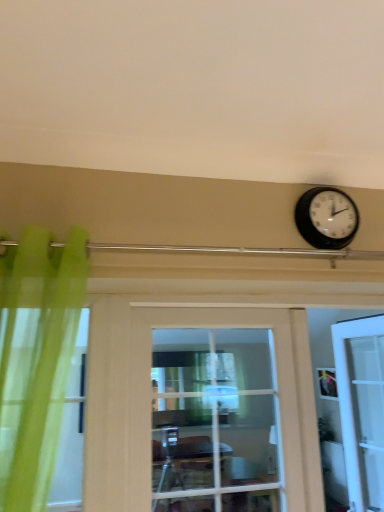
This screenshot has width=384, height=512. What are the coordinates of `black plastic wall clock at upper right` in the screenshot? It's located at (326, 218).

This screenshot has width=384, height=512. What do you see at coordinates (214, 411) in the screenshot?
I see `clear glass door at center, the 2th door when ordered from right to left` at bounding box center [214, 411].

What do you see at coordinates (362, 407) in the screenshot? I see `white glossy door at right, which ranks as the 2th door in left-to-right order` at bounding box center [362, 407].

I want to click on black plastic wall clock at upper right, so click(326, 218).

In terms of size, does clear glass door at center, the second door from the back, appear bigger or smaller than black plastic wall clock at upper right?

Clearly, clear glass door at center, the second door from the back, is larger in size than black plastic wall clock at upper right.

Considering the sizes of objects clear glass door at center, which is the 1th door from left to right, and black plastic wall clock at upper right in the image provided, who is taller, clear glass door at center, which is the 1th door from left to right, or black plastic wall clock at upper right?

clear glass door at center, which is the 1th door from left to right.

Is clear glass door at center, arranged as the first door when viewed from the front, aimed at black plastic wall clock at upper right?

No.

Does point (254, 424) come behind point (344, 224)?

Yes, it is behind point (344, 224).

Considering the sizes of objects clear glass door at center, arranged as the first door when viewed from the front, and white glossy door at right, which is the 2th door in front-to-back order, in the image provided, who is thinner, clear glass door at center, arranged as the first door when viewed from the front, or white glossy door at right, which is the 2th door in front-to-back order,?

white glossy door at right, which is the 2th door in front-to-back order.

From the image's perspective, is clear glass door at center, the 2th door when ordered from right to left, positioned above or below white glossy door at right, which is the 2th door in front-to-back order?

Clearly, from the image's perspective, clear glass door at center, the 2th door when ordered from right to left, is above white glossy door at right, which is the 2th door in front-to-back order.

Relative to white glossy door at right, which ranks as the 2th door in left-to-right order, is clear glass door at center, arranged as the first door when viewed from the front, in front or behind?

clear glass door at center, arranged as the first door when viewed from the front, is positioned closer to the viewer than white glossy door at right, which ranks as the 2th door in left-to-right order.

Is white glossy door at right, which ranks as the 2th door in left-to-right order, beside clear glass door at center, the second door from the back?

No, white glossy door at right, which ranks as the 2th door in left-to-right order, is not in contact with clear glass door at center, the second door from the back.

Is white glossy door at right, which is the 1th door in right-to-left order, outside of clear glass door at center, which is the 1th door from left to right?

Yes, white glossy door at right, which is the 1th door in right-to-left order, is not within clear glass door at center, which is the 1th door from left to right.

From a real-world perspective, is white glossy door at right, which is the 1th door in right-to-left order, physically located above or below clear glass door at center, the 2th door when ordered from right to left?

Clearly, from a real-world perspective, white glossy door at right, which is the 1th door in right-to-left order, is below clear glass door at center, the 2th door when ordered from right to left.

Is point (343, 399) closer to viewer compared to point (228, 438)?

That is False.

Can you confirm if black plastic wall clock at upper right is wider than clear glass door at center, the 2th door when ordered from right to left?

In fact, black plastic wall clock at upper right might be narrower than clear glass door at center, the 2th door when ordered from right to left.

Looking at this image, from a real-world perspective, between black plastic wall clock at upper right and clear glass door at center, which is the 1th door from left to right, who is vertically lower?

From a 3D spatial view, clear glass door at center, which is the 1th door from left to right, is below.

Could you tell me if black plastic wall clock at upper right is facing clear glass door at center, which is the 1th door from left to right?

No, black plastic wall clock at upper right is not facing towards clear glass door at center, which is the 1th door from left to right.

In terms of size, does black plastic wall clock at upper right appear bigger or smaller than clear glass door at center, which is the 1th door from left to right?

Clearly, black plastic wall clock at upper right is smaller in size than clear glass door at center, which is the 1th door from left to right.

Which is behind, black plastic wall clock at upper right or white glossy door at right, marked as the first door in a back-to-front arrangement?

Positioned behind is white glossy door at right, marked as the first door in a back-to-front arrangement.

From a real-world perspective, is black plastic wall clock at upper right positioned under white glossy door at right, which ranks as the 2th door in left-to-right order, based on gravity?

Incorrect, from a real-world perspective, black plastic wall clock at upper right is higher than white glossy door at right, which ranks as the 2th door in left-to-right order.

Is black plastic wall clock at upper right smaller than white glossy door at right, which ranks as the 2th door in left-to-right order?

Indeed, black plastic wall clock at upper right has a smaller size compared to white glossy door at right, which ranks as the 2th door in left-to-right order.

From the image's perspective, which object appears higher, black plastic wall clock at upper right or white glossy door at right, which is the 2th door in front-to-back order?

black plastic wall clock at upper right is shown above in the image.

Who is more distant, white glossy door at right, which is the 2th door in front-to-back order, or black plastic wall clock at upper right?

white glossy door at right, which is the 2th door in front-to-back order, is more distant.

Is white glossy door at right, which is the 2th door in front-to-back order, completely or partially outside of black plastic wall clock at upper right?

white glossy door at right, which is the 2th door in front-to-back order, lies outside black plastic wall clock at upper right's area.

Is white glossy door at right, which is the 1th door in right-to-left order, bigger or smaller than black plastic wall clock at upper right?

white glossy door at right, which is the 1th door in right-to-left order, is bigger than black plastic wall clock at upper right.

How many degrees apart are the facing directions of white glossy door at right, marked as the first door in a back-to-front arrangement, and black plastic wall clock at upper right?

The angular difference between white glossy door at right, marked as the first door in a back-to-front arrangement, and black plastic wall clock at upper right is 87.1 degrees.

At what (x,y) coordinates should I click in order to perform the action: click on door located on the left of black plastic wall clock at upper right. Please return your answer as a coordinate pair (x, y). The height and width of the screenshot is (512, 384). Looking at the image, I should click on (214, 411).

The height and width of the screenshot is (512, 384). Identify the location of door below the clear glass door at center, which is the 1th door from left to right (from the image's perspective). (362, 407).

Based on their spatial positions, is clear glass door at center, arranged as the first door when viewed from the front, or white glossy door at right, which is the 2th door in front-to-back order, further from black plastic wall clock at upper right?

white glossy door at right, which is the 2th door in front-to-back order, is further to black plastic wall clock at upper right.

From the image, which object appears to be nearer to clear glass door at center, the 2th door when ordered from right to left, black plastic wall clock at upper right or white glossy door at right, which ranks as the 2th door in left-to-right order?

Among the two, black plastic wall clock at upper right is located nearer to clear glass door at center, the 2th door when ordered from right to left.

When comparing their distances from white glossy door at right, which is the 2th door in front-to-back order, does black plastic wall clock at upper right or clear glass door at center, the 2th door when ordered from right to left, seem closer?

The object closer to white glossy door at right, which is the 2th door in front-to-back order, is clear glass door at center, the 2th door when ordered from right to left.

Estimate the real-world distances between objects in this image. Which object is further from clear glass door at center, which is the 1th door from left to right, white glossy door at right, which is the 1th door in right-to-left order, or black plastic wall clock at upper right?

Among the two, white glossy door at right, which is the 1th door in right-to-left order, is located further to clear glass door at center, which is the 1th door from left to right.

Which object lies further to the anchor point black plastic wall clock at upper right, white glossy door at right, which is the 2th door in front-to-back order, or clear glass door at center, which is the 1th door from left to right?

Based on the image, white glossy door at right, which is the 2th door in front-to-back order, appears to be further to black plastic wall clock at upper right.

Based on the photo, from the image, which object appears to be nearer to white glossy door at right, marked as the first door in a back-to-front arrangement, clear glass door at center, which is the 1th door from left to right, or black plastic wall clock at upper right?

clear glass door at center, which is the 1th door from left to right, lies closer to white glossy door at right, marked as the first door in a back-to-front arrangement, than the other object.

Identify the location of door between black plastic wall clock at upper right and white glossy door at right, which is the 2th door in front-to-back order, vertically. (214, 411).